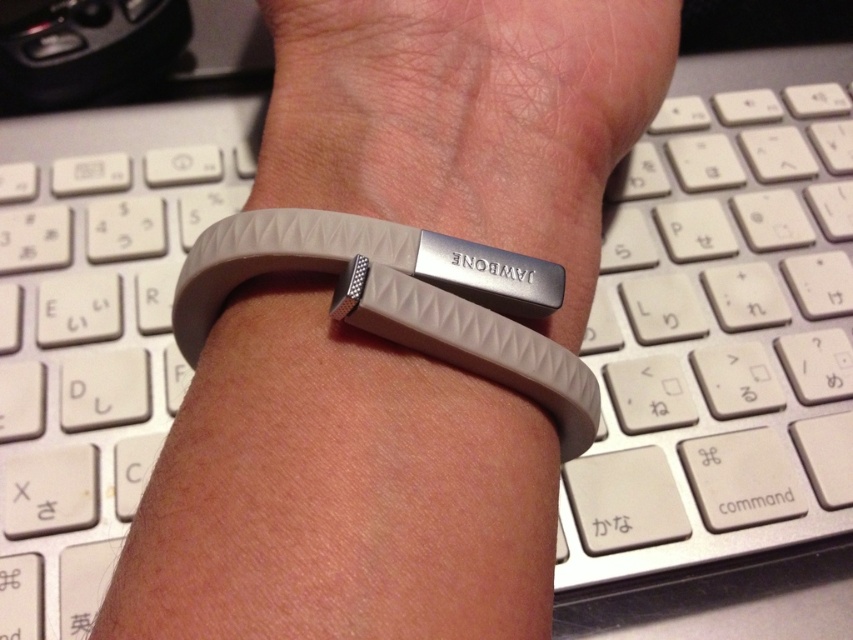
The height and width of the screenshot is (640, 853). What do you see at coordinates (722, 324) in the screenshot?
I see `white plastic keyboard at center` at bounding box center [722, 324].

Does white plastic keyboard at center appear on the right side of gray rubber wristband at center?

Yes, white plastic keyboard at center is to the right of gray rubber wristband at center.

Where is `white plastic keyboard at center`? The image size is (853, 640). white plastic keyboard at center is located at coordinates (722, 324).

Does matte gray wristband at center have a larger size compared to white plastic keyboard at center?

No, matte gray wristband at center is not bigger than white plastic keyboard at center.

Is matte gray wristband at center below white plastic keyboard at center?

Correct, matte gray wristband at center is located below white plastic keyboard at center.

Which is in front, point (381, 131) or point (686, 189)?

Point (381, 131) is in front.

The height and width of the screenshot is (640, 853). In order to click on matte gray wristband at center in this screenshot , I will do `click(337, 492)`.

Measure the distance between matte gray wristband at center and camera.

The distance of matte gray wristband at center from camera is 13.11 inches.

Is point (596, 237) farther from camera compared to point (509, 346)?

Yes, point (596, 237) is behind point (509, 346).

Is point (374, 557) behind point (219, 292)?

No, it is in front of (219, 292).

Locate an element on the screen. The height and width of the screenshot is (640, 853). matte gray wristband at center is located at coordinates (337, 492).